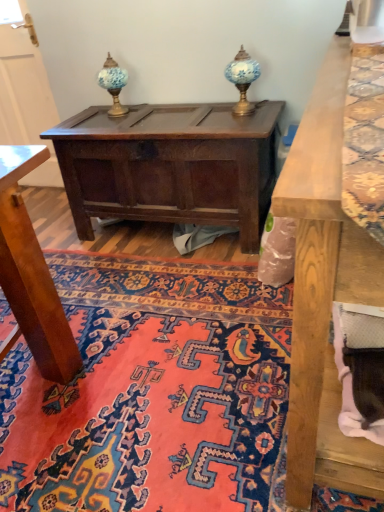
Question: From the image's perspective, would you say dark brown wood chest at center is positioned over blue glass table lamp at upper center, which is counted as the 1th table lamp, starting from the left?

Choices:
 (A) yes
 (B) no

Answer: (B)

Question: Is dark brown wood chest at center to the left of blue glass table lamp at upper center, arranged as the 2th table lamp when viewed from the right, from the viewer's perspective?

Choices:
 (A) yes
 (B) no

Answer: (B)

Question: Considering the relative sizes of dark brown wood chest at center and blue glass table lamp at upper center, which is counted as the 1th table lamp, starting from the left, in the image provided, is dark brown wood chest at center taller than blue glass table lamp at upper center, which is counted as the 1th table lamp, starting from the left,?

Choices:
 (A) yes
 (B) no

Answer: (A)

Question: Are dark brown wood chest at center and blue glass table lamp at upper center, which is counted as the 1th table lamp, starting from the left, located far from each other?

Choices:
 (A) no
 (B) yes

Answer: (A)

Question: Does dark brown wood chest at center have a greater width compared to blue glass table lamp at upper center, arranged as the 2th table lamp when viewed from the right?

Choices:
 (A) yes
 (B) no

Answer: (A)

Question: Is point (117, 195) positioned closer to the camera than point (112, 91)?

Choices:
 (A) closer
 (B) farther

Answer: (B)

Question: In terms of height, does dark brown wood chest at center look taller or shorter compared to blue glass table lamp at upper center, arranged as the 2th table lamp when viewed from the right?

Choices:
 (A) short
 (B) tall

Answer: (B)

Question: Is dark brown wood chest at center wider or thinner than blue glass table lamp at upper center, which is counted as the 1th table lamp, starting from the left?

Choices:
 (A) thin
 (B) wide

Answer: (B)

Question: From a real-world perspective, is dark brown wood chest at center physically located above or below blue glass table lamp at upper center, arranged as the 2th table lamp when viewed from the right?

Choices:
 (A) above
 (B) below

Answer: (B)

Question: Considering the positions of point (145, 158) and point (226, 438), is point (145, 158) closer or farther from the camera than point (226, 438)?

Choices:
 (A) farther
 (B) closer

Answer: (A)

Question: In terms of height, does dark brown wood chest at center look taller or shorter compared to carpet with intricate patterns at center?

Choices:
 (A) short
 (B) tall

Answer: (B)

Question: From the image's perspective, relative to carpet with intricate patterns at center, is dark brown wood chest at center above or below?

Choices:
 (A) above
 (B) below

Answer: (A)

Question: Is dark brown wood chest at center situated inside carpet with intricate patterns at center or outside?

Choices:
 (A) inside
 (B) outside

Answer: (B)

Question: Is dark brown wood chest at center in front of or behind blue glass table lamp at upper center, the second table lamp from the left, in the image?

Choices:
 (A) behind
 (B) front

Answer: (B)

Question: In terms of size, does dark brown wood chest at center appear bigger or smaller than blue glass table lamp at upper center, positioned as the 1th table lamp in right-to-left order?

Choices:
 (A) small
 (B) big

Answer: (B)